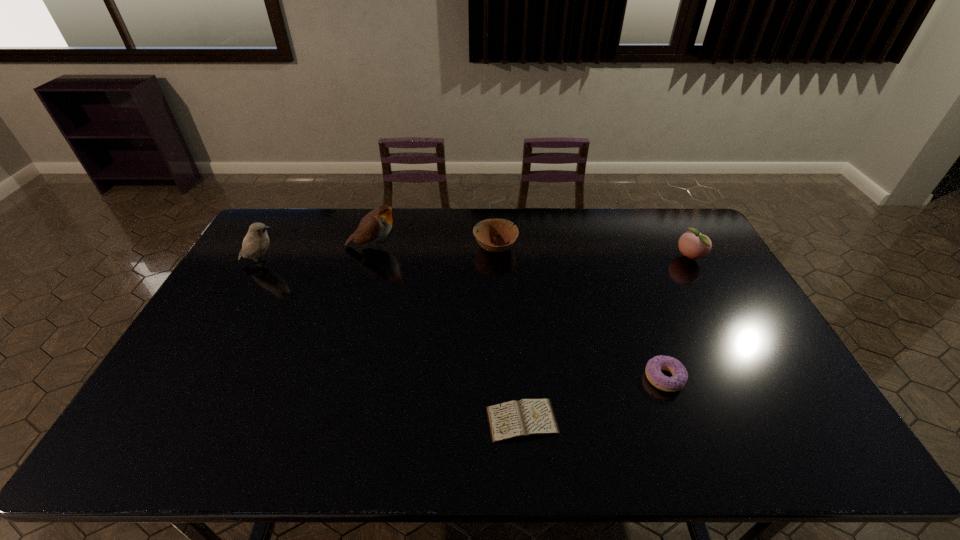
The height and width of the screenshot is (540, 960). Find the location of `the second object from left to right`. the second object from left to right is located at coordinates [376, 225].

The image size is (960, 540). I want to click on the farther bird, so click(x=376, y=225).

Locate an element on the screen. The width and height of the screenshot is (960, 540). the nearer bird is located at coordinates (256, 242).

Locate an element on the screen. Image resolution: width=960 pixels, height=540 pixels. the leftmost object is located at coordinates (256, 242).

This screenshot has width=960, height=540. I want to click on the rightmost object, so click(694, 245).

Where is `peach`? peach is located at coordinates (694, 245).

This screenshot has height=540, width=960. What are the coordinates of `the third shortest object` in the screenshot? It's located at 486,229.

The width and height of the screenshot is (960, 540). In order to click on the fifth farthest object in this screenshot , I will do `click(654, 366)`.

Find the location of a particular element. Image resolution: width=960 pixels, height=540 pixels. the fifth tallest object is located at coordinates (654, 366).

In order to click on the shortest object in this screenshot , I will do `click(525, 418)`.